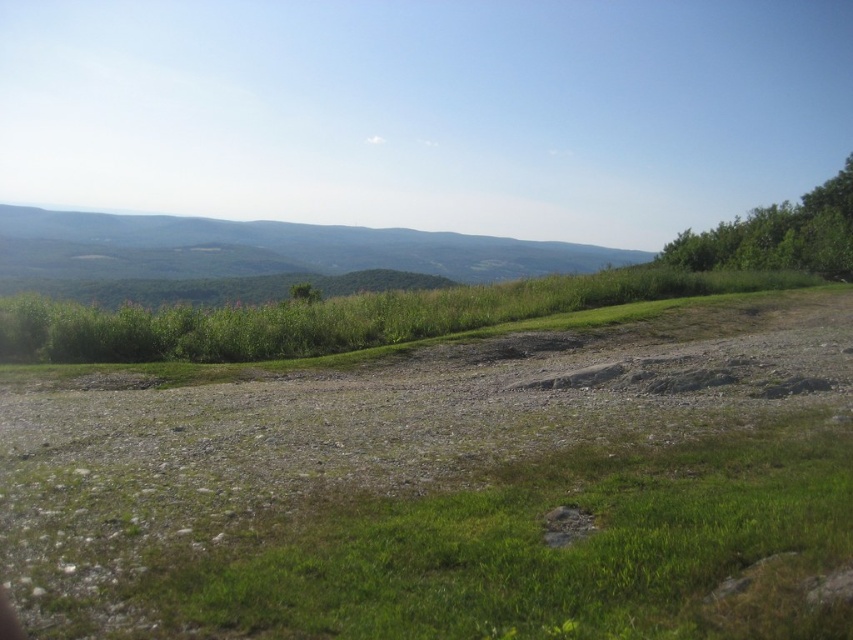
Is dull gray gravel at center below green leafy tree at upper right?

Yes, dull gray gravel at center is below green leafy tree at upper right.

Can you confirm if dull gray gravel at center is positioned to the right of green leafy tree at upper right?

Incorrect, dull gray gravel at center is not on the right side of green leafy tree at upper right.

Where is `dull gray gravel at center`? dull gray gravel at center is located at coordinates (448, 486).

Is point (799, 228) positioned before point (308, 289)?

No, it is behind (308, 289).

Is green leafy tree at upper right wider than green leafy tree at center?

Correct, the width of green leafy tree at upper right exceeds that of green leafy tree at center.

The height and width of the screenshot is (640, 853). I want to click on green leafy tree at upper right, so click(778, 236).

Image resolution: width=853 pixels, height=640 pixels. I want to click on green leafy tree at upper right, so click(778, 236).

Does green grassy hill at upper center have a lesser width compared to green leafy tree at upper right?

Incorrect, green grassy hill at upper center's width is not less than green leafy tree at upper right's.

Who is taller, green grassy hill at upper center or green leafy tree at upper right?

green leafy tree at upper right is taller.

At what (x,y) coordinates should I click in order to perform the action: click on green grassy hill at upper center. Please return your answer as a coordinate pair (x, y). Looking at the image, I should click on (267, 250).

Find the location of a particular element. The height and width of the screenshot is (640, 853). green grassy hill at upper center is located at coordinates (267, 250).